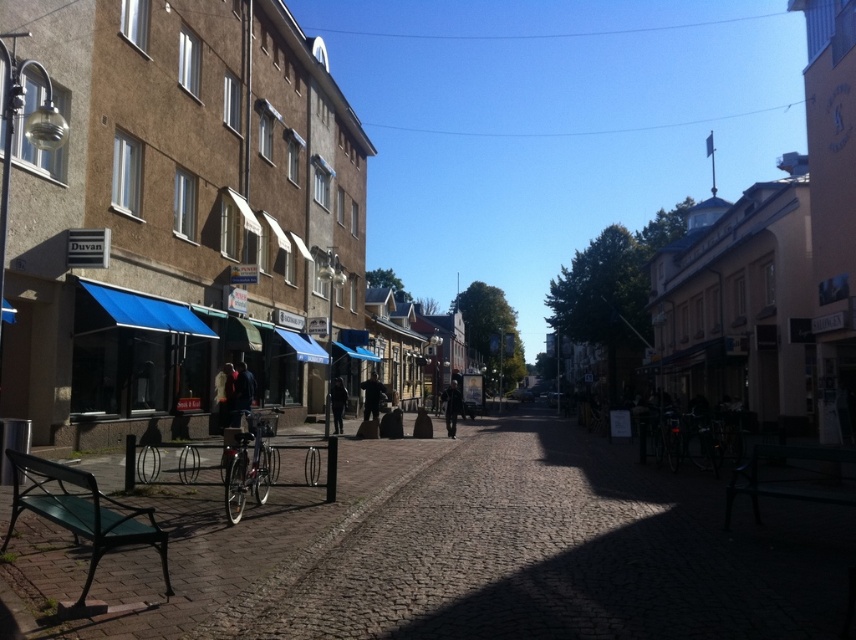
Question: Can you confirm if black matte jacket at center is positioned to the right of dark blue jeans at center?

Choices:
 (A) yes
 (B) no

Answer: (A)

Question: Is dark brown leather jacket at center smaller than black matte jacket at center?

Choices:
 (A) no
 (B) yes

Answer: (B)

Question: Which point appears farthest from the camera in this image?

Choices:
 (A) (453, 392)
 (B) (333, 385)
 (C) (241, 406)

Answer: (A)

Question: Can you confirm if dark blue jacket at center is positioned below black matte jacket at center?

Choices:
 (A) yes
 (B) no

Answer: (B)

Question: Among these points, which one is farthest from the camera?

Choices:
 (A) [367, 380]
 (B) [453, 416]
 (C) [238, 385]
 (D) [339, 420]

Answer: (A)

Question: Which of the following is the closest to the observer?

Choices:
 (A) dark blue jeans at center
 (B) black matte jacket at center
 (C) dark blue jacket at center

Answer: (C)